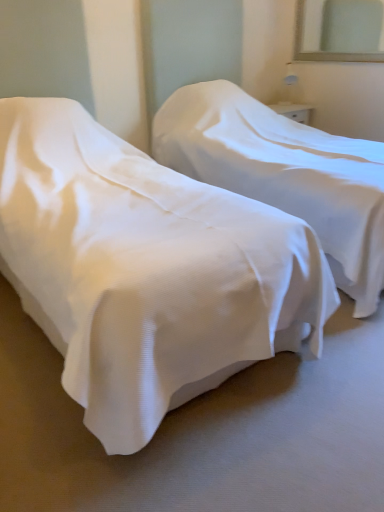
Question: From a real-world perspective, is white fabric bed at center, the second bed viewed from the right, positioned under clear glass mirror at upper right based on gravity?

Choices:
 (A) no
 (B) yes

Answer: (B)

Question: Considering the relative positions of white fabric bed at center, the second bed viewed from the right, and clear glass mirror at upper right in the image provided, is white fabric bed at center, the second bed viewed from the right, to the left of clear glass mirror at upper right from the viewer's perspective?

Choices:
 (A) no
 (B) yes

Answer: (B)

Question: Is white fabric bed at center, the second bed viewed from the right, in front of clear glass mirror at upper right?

Choices:
 (A) no
 (B) yes

Answer: (B)

Question: Is white fabric bed at center, the second bed viewed from the right, outside of clear glass mirror at upper right?

Choices:
 (A) no
 (B) yes

Answer: (B)

Question: Is white fabric bed at center, which is the first bed in left-to-right order, wider than clear glass mirror at upper right?

Choices:
 (A) yes
 (B) no

Answer: (A)

Question: Considering the relative sizes of white fabric bed at center, which is the first bed in left-to-right order, and clear glass mirror at upper right in the image provided, is white fabric bed at center, which is the first bed in left-to-right order, thinner than clear glass mirror at upper right?

Choices:
 (A) no
 (B) yes

Answer: (A)

Question: Is white fabric bed at center, which is the first bed in left-to-right order, located within white fabric bed at center, marked as the 1th bed in a right-to-left arrangement?

Choices:
 (A) yes
 (B) no

Answer: (B)

Question: From a real-world perspective, does white fabric bed at center, acting as the 2th bed starting from the left, sit lower than white fabric bed at center, the second bed viewed from the right?

Choices:
 (A) no
 (B) yes

Answer: (A)

Question: Does white fabric bed at center, acting as the 2th bed starting from the left, appear on the right side of white fabric bed at center, the second bed viewed from the right?

Choices:
 (A) yes
 (B) no

Answer: (A)

Question: Is white fabric bed at center, acting as the 2th bed starting from the left, next to white fabric bed at center, which is the first bed in left-to-right order?

Choices:
 (A) no
 (B) yes

Answer: (A)

Question: Is white fabric bed at center, acting as the 2th bed starting from the left, looking in the opposite direction of white fabric bed at center, which is the first bed in left-to-right order?

Choices:
 (A) no
 (B) yes

Answer: (A)

Question: Could you tell me if white fabric bed at center, acting as the 2th bed starting from the left, is facing white fabric bed at center, the second bed viewed from the right?

Choices:
 (A) no
 (B) yes

Answer: (A)

Question: Considering the relative sizes of white fabric bed at center, the second bed viewed from the right, and white fabric bed at center, marked as the 1th bed in a right-to-left arrangement, in the image provided, is white fabric bed at center, the second bed viewed from the right, bigger than white fabric bed at center, marked as the 1th bed in a right-to-left arrangement,?

Choices:
 (A) yes
 (B) no

Answer: (B)